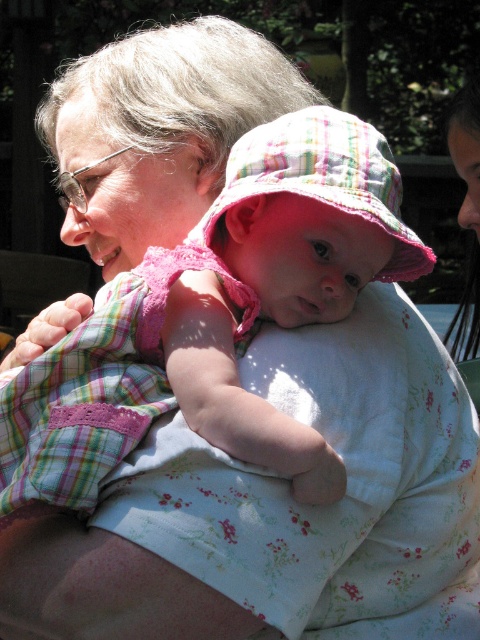
Question: Which of the following is the closest to the observer?

Choices:
 (A) (387, 157)
 (B) (59, 435)

Answer: (B)

Question: Can you confirm if pink plaid dress at center is wider than pink plaid hat at center?

Choices:
 (A) yes
 (B) no

Answer: (A)

Question: Is pink plaid dress at center closer to camera compared to pink plaid hat at center?

Choices:
 (A) yes
 (B) no

Answer: (A)

Question: Which of the following is the farthest from the observer?

Choices:
 (A) (356, 136)
 (B) (295, 170)

Answer: (A)

Question: Is pink plaid dress at center closer to the viewer compared to pink plaid hat at center?

Choices:
 (A) no
 (B) yes

Answer: (B)